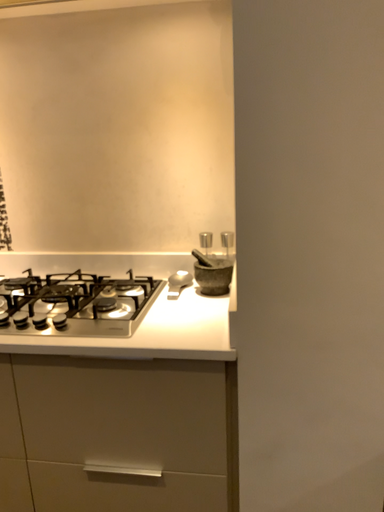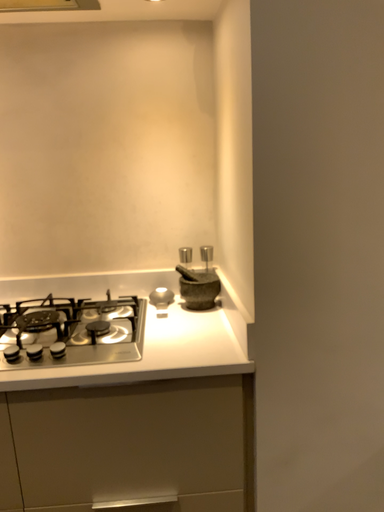
Question: How did the camera likely rotate when shooting the video?

Choices:
 (A) rotated right
 (B) rotated left

Answer: (A)